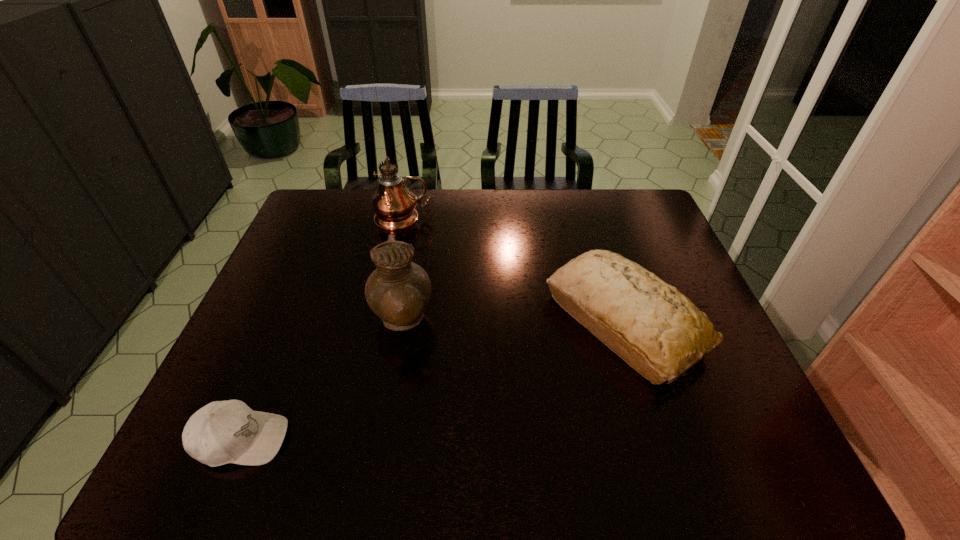
This screenshot has height=540, width=960. In the image, there is a desktop. Find the location of `free space at the far right corner`. free space at the far right corner is located at coordinates (622, 207).

In the image, there is a desktop. At what (x,y) coordinates should I click in order to perform the action: click on vacant space at the near right corner. Please return your answer as a coordinate pair (x, y). The image size is (960, 540). Looking at the image, I should click on (741, 452).

Where is `vacant point located between the nearest object and the pitcher`? Image resolution: width=960 pixels, height=540 pixels. vacant point located between the nearest object and the pitcher is located at coordinates (322, 380).

Identify the location of free space between the leftmost object and the rightmost object. (433, 381).

Find the location of a particular element. The image size is (960, 540). empty space that is in between the baseball cap and the oil lamp is located at coordinates (323, 329).

This screenshot has width=960, height=540. Identify the location of vacant space that is in between the baseball cap and the pitcher. (322, 380).

What are the coordinates of `unoccupied area between the baseball cap and the oil lamp` in the screenshot? It's located at coord(323,329).

Locate an element on the screen. The width and height of the screenshot is (960, 540). unoccupied area between the second shortest object and the nearest object is located at coordinates (433, 381).

Identify the location of the third closest object to the oil lamp. The width and height of the screenshot is (960, 540). (222, 432).

Find the location of a particular element. This screenshot has height=540, width=960. object that stands as the second closest to the second shortest object is located at coordinates (394, 204).